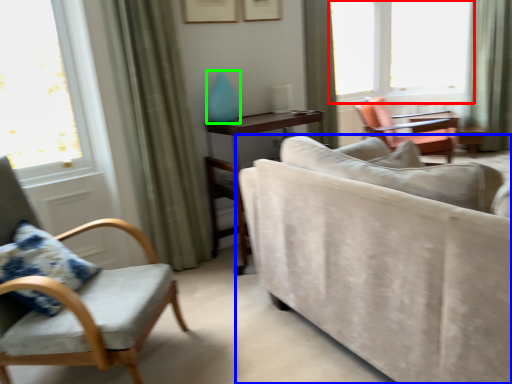
Question: Which is nearer to the window (highlighted by a red box)? studio couch (highlighted by a blue box) or turquoise (highlighted by a green box).

Choices:
 (A) studio couch
 (B) turquoise

Answer: (B)